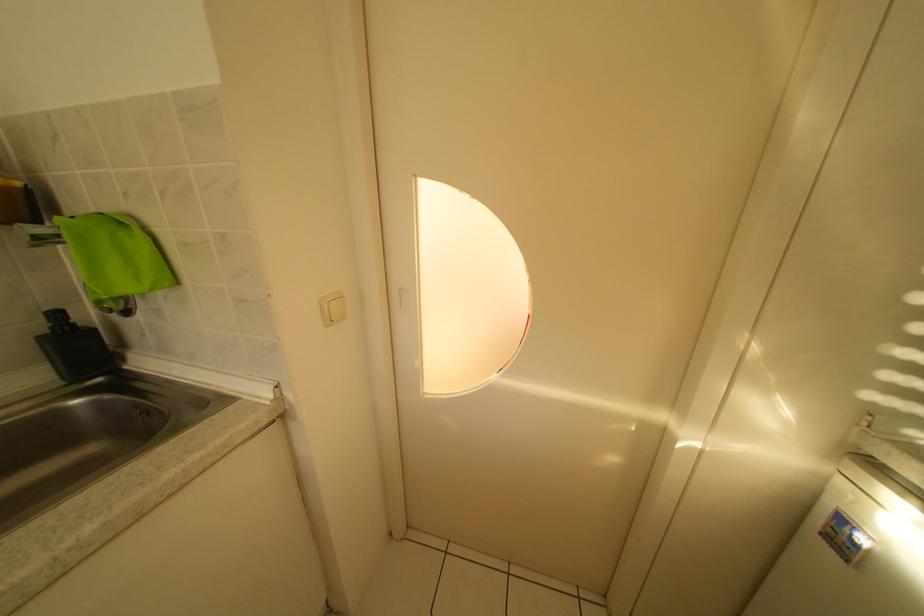
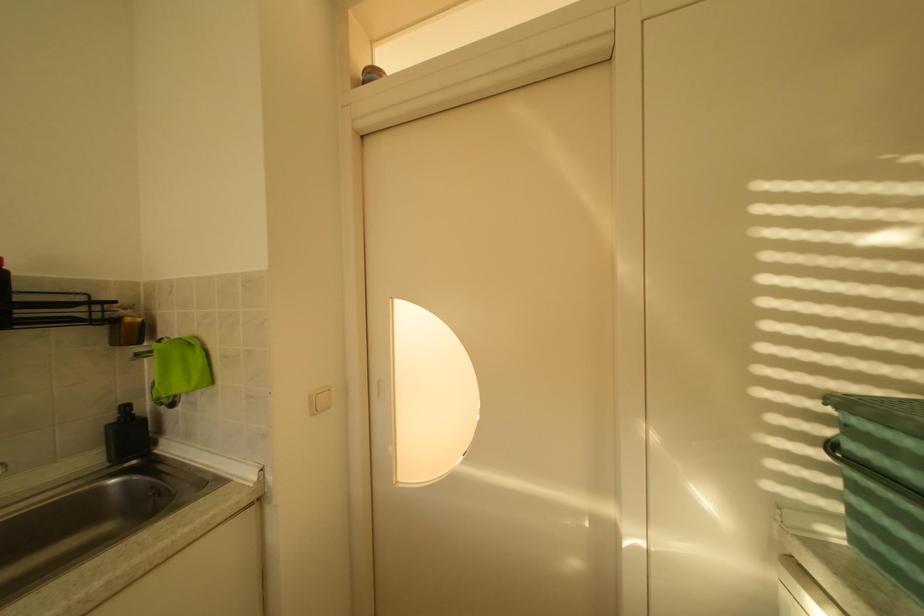
Question: How did the camera likely rotate?

Choices:
 (A) Left
 (B) Right
 (C) Up
 (D) Down

Answer: (C)